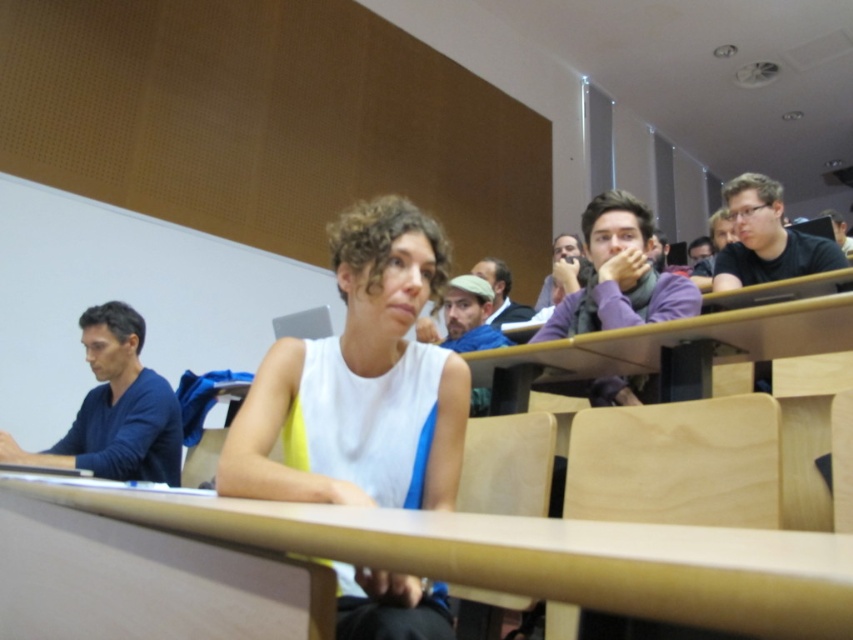
You are a student trying to place a 10 inch ruler on the desk without it hanging off. Can the ruler fit entirely on the wooden table at center if placed near the white matte tank top at center?

The white matte tank top at center is 9.59 inches away from the wooden table at center. Since the ruler is 10 inches long, placing it near the tank top would leave only 9.59 inches of space, which is slightly shorter than the ruler. Therefore, the ruler cannot fit entirely on the wooden table at center without hanging off.

You are standing at the entrance of the classroom and want to locate the white matte tank top at center. According to the coordinates provided, where should you look to find it?

The white matte tank top at center is located at the coordinates point (x=358, y=381), which means it is positioned slightly to the right and middle of the classroom.